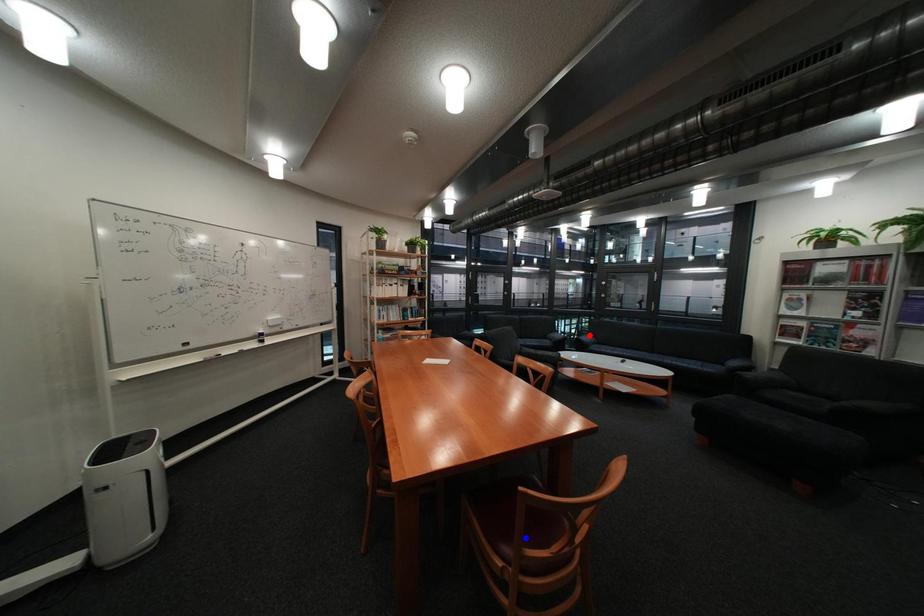
Question: Which of the two points in the image is closer to the camera?

Choices:
 (A) Blue point is closer.
 (B) Red point is closer.

Answer: (A)